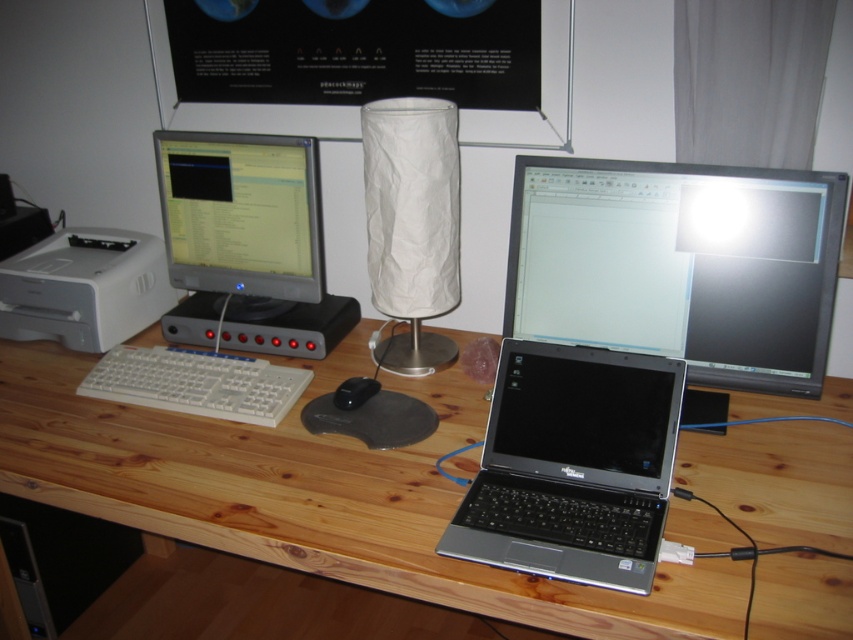
Can you confirm if matte silver monitor at left is shorter than white plastic printer at left?

In fact, matte silver monitor at left may be taller than white plastic printer at left.

Who is lower down, matte silver monitor at left or white plastic printer at left?

Positioned lower is white plastic printer at left.

Between point (270, 257) and point (57, 340), which one is positioned in front?

Point (270, 257) is in front.

The image size is (853, 640). In order to click on matte silver monitor at left in this screenshot , I will do `click(242, 218)`.

Is wooden desk at center thinner than white crumpled paper lampshade at center?

In fact, wooden desk at center might be wider than white crumpled paper lampshade at center.

Does wooden desk at center have a smaller size compared to white crumpled paper lampshade at center?

Actually, wooden desk at center might be larger than white crumpled paper lampshade at center.

What do you see at coordinates (315, 496) in the screenshot? I see `wooden desk at center` at bounding box center [315, 496].

The image size is (853, 640). I want to click on wooden desk at center, so click(x=315, y=496).

Is point (482, 534) farther from viewer compared to point (109, 369)?

No, it is not.

From the picture: How far apart are satin black laptop at lower right and white plastic keyboard at left?

They are 20.55 inches apart.

This screenshot has width=853, height=640. I want to click on satin black laptop at lower right, so click(573, 465).

Find the location of a particular element. The height and width of the screenshot is (640, 853). satin black laptop at lower right is located at coordinates (573, 465).